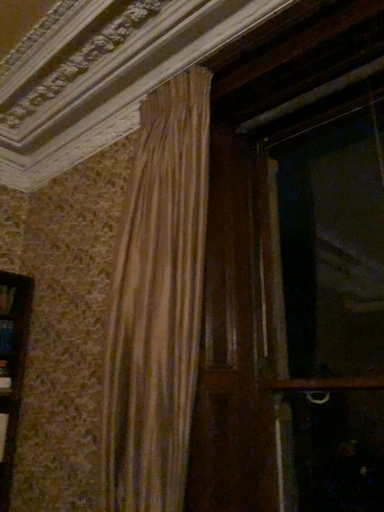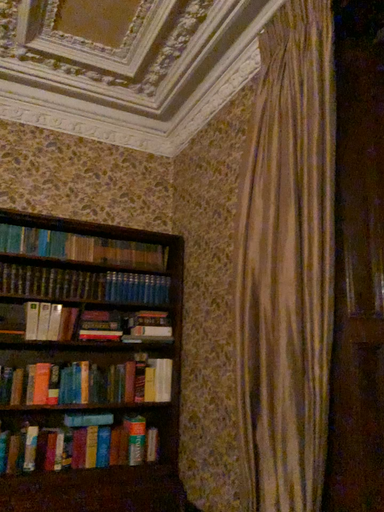
Question: How did the camera likely rotate when shooting the video?

Choices:
 (A) rotated upward
 (B) rotated downward

Answer: (B)